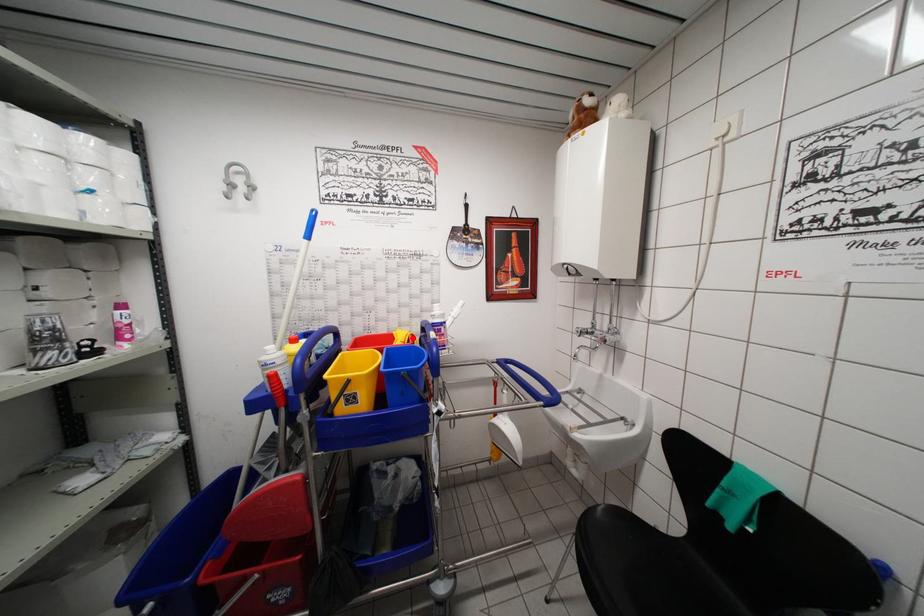
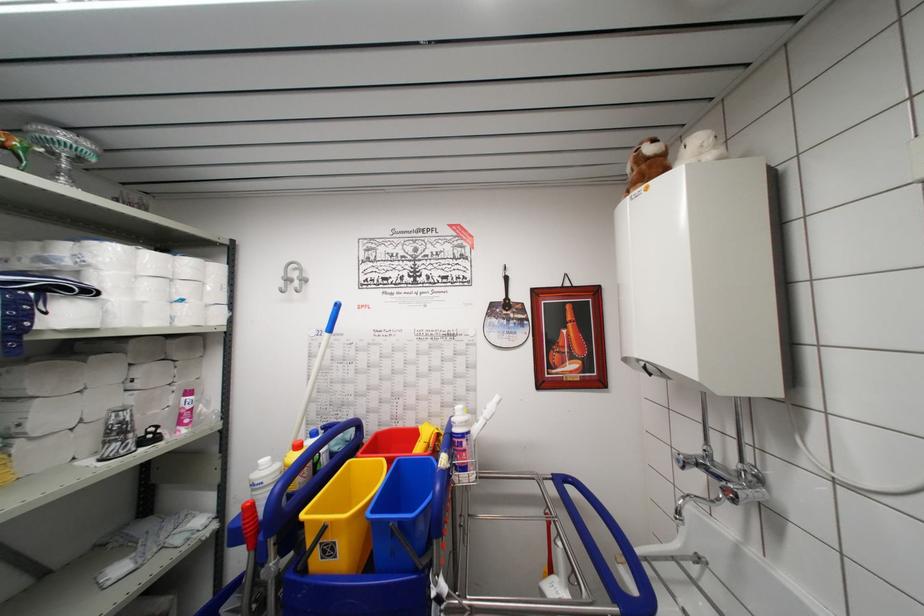
The point at the highlighted location is marked in the first image. Where is the corresponding point in the second image?

(439, 436)